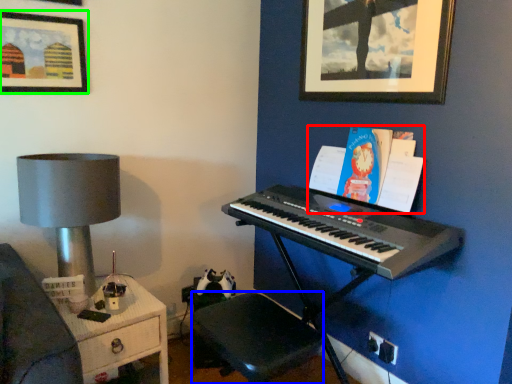
Question: Which object is the farthest from book (highlighted by a red box)? Choose among these: music stool (highlighted by a blue box) or picture frame (highlighted by a green box).

Choices:
 (A) music stool
 (B) picture frame

Answer: (B)